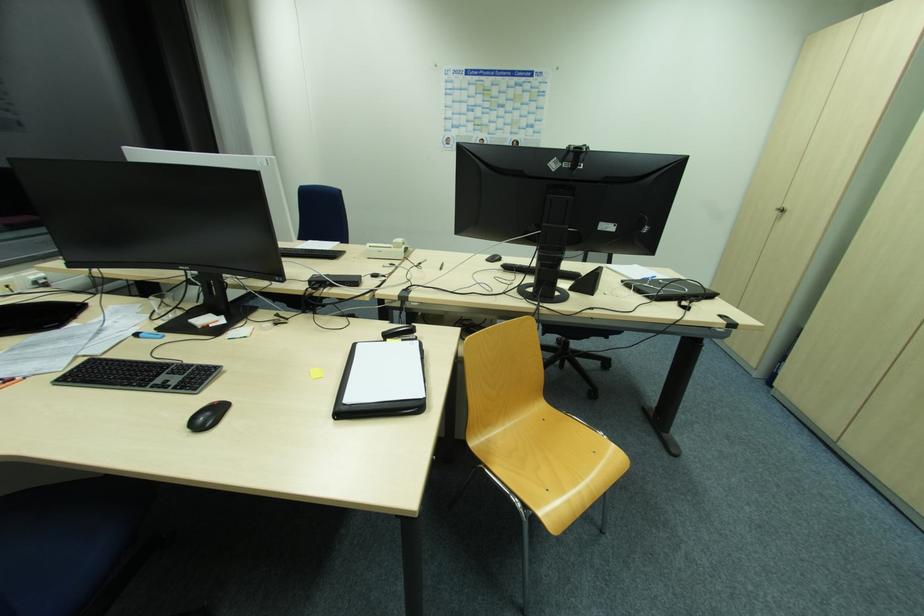
Where is `white telephone handset`? white telephone handset is located at coordinates (387, 249).